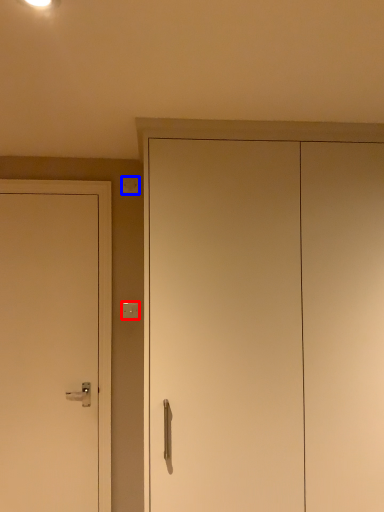
Question: Which point is further to the camera, light switch (highlighted by a red box) or light switch (highlighted by a blue box)?

Choices:
 (A) light switch
 (B) light switch

Answer: (B)